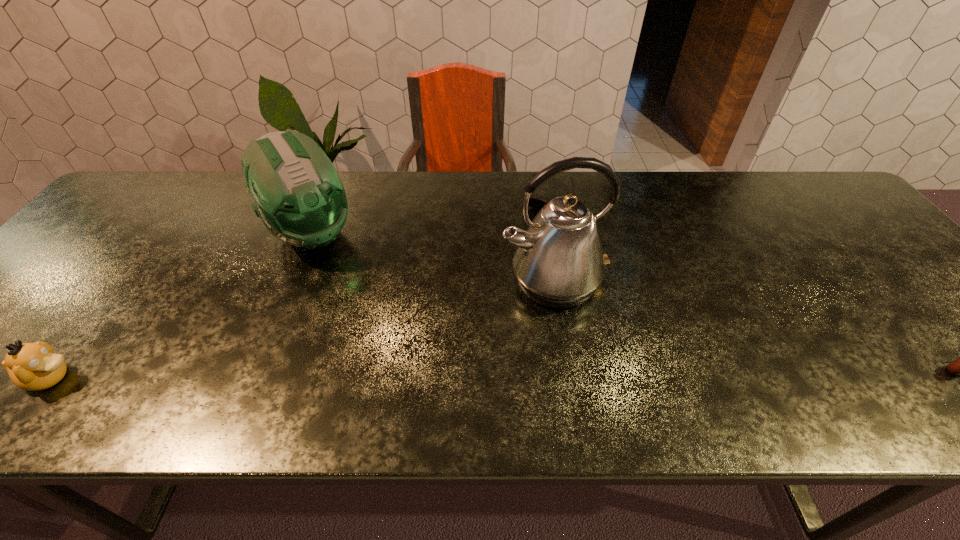
I want to click on the second shortest object, so click(x=31, y=366).

At what (x,y) coordinates should I click in order to perform the action: click on the nearest object. Please return your answer as a coordinate pair (x, y). The height and width of the screenshot is (540, 960). Looking at the image, I should click on (31, 366).

This screenshot has height=540, width=960. I want to click on the shortest object, so click(537, 203).

The height and width of the screenshot is (540, 960). Identify the location of the second tallest object. (298, 194).

Where is `football helmet`? The height and width of the screenshot is (540, 960). football helmet is located at coordinates (298, 194).

In order to click on kettle in this screenshot , I will do (x=559, y=263).

In order to click on vacant space positioned 0.190m on the face of the leftmost object in this screenshot , I will do `click(174, 378)`.

Where is `free space located on the front-facing side of the shortest object`? The width and height of the screenshot is (960, 540). free space located on the front-facing side of the shortest object is located at coordinates (538, 262).

In order to click on vacant space located on the front-facing side of the shortest object in this screenshot , I will do `click(538, 257)`.

The height and width of the screenshot is (540, 960). I want to click on free location located on the front-facing side of the shortest object, so click(x=532, y=298).